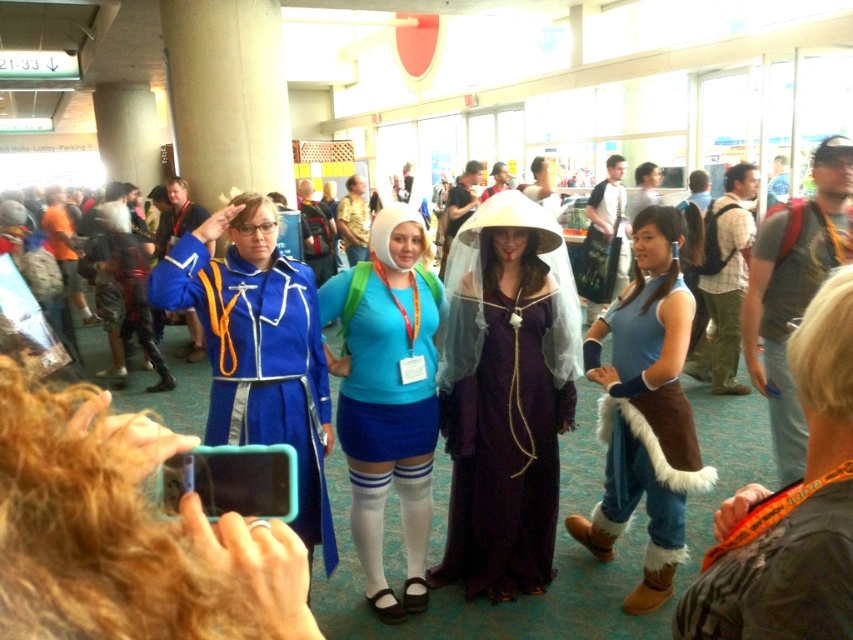
Locate an element on the screen. blue suede boots at lower right is located at coordinates (646, 406).

Between blue suede boots at lower right and orange lanyard at lower right, which one has more height?

blue suede boots at lower right

Where is `blue suede boots at lower right`? This screenshot has width=853, height=640. blue suede boots at lower right is located at coordinates (646, 406).

Measure the distance between orange lanyard at lower right and camera.

orange lanyard at lower right and camera are 29.04 inches apart from each other.

Can you confirm if orange lanyard at lower right is positioned above blue fabric dress at center?

Incorrect, orange lanyard at lower right is not positioned above blue fabric dress at center.

Describe the element at coordinates (778, 570) in the screenshot. I see `orange lanyard at lower right` at that location.

Where is `orange lanyard at lower right`? The width and height of the screenshot is (853, 640). orange lanyard at lower right is located at coordinates (778, 570).

Consider the image. Can you confirm if purple satin dress at center is positioned to the left of blue suede boots at lower right?

Yes, purple satin dress at center is to the left of blue suede boots at lower right.

Who is lower down, purple satin dress at center or blue suede boots at lower right?

blue suede boots at lower right is below.

Is point (519, 458) behind point (701, 486)?

Yes, it is.

Find the location of a particular element. This screenshot has width=853, height=640. purple satin dress at center is located at coordinates (506, 396).